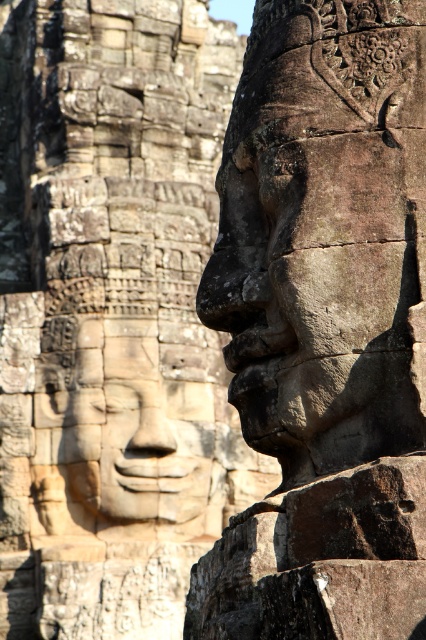
You are an archaeologist examining the ancient stone carvings. You notice two points marked on the wall at coordinates point (408, 372) and point (118, 433). Which point is closer to you as you stand in front of the carvings?

Point (408, 372) is in front of point (118, 433), so it is closer to you.